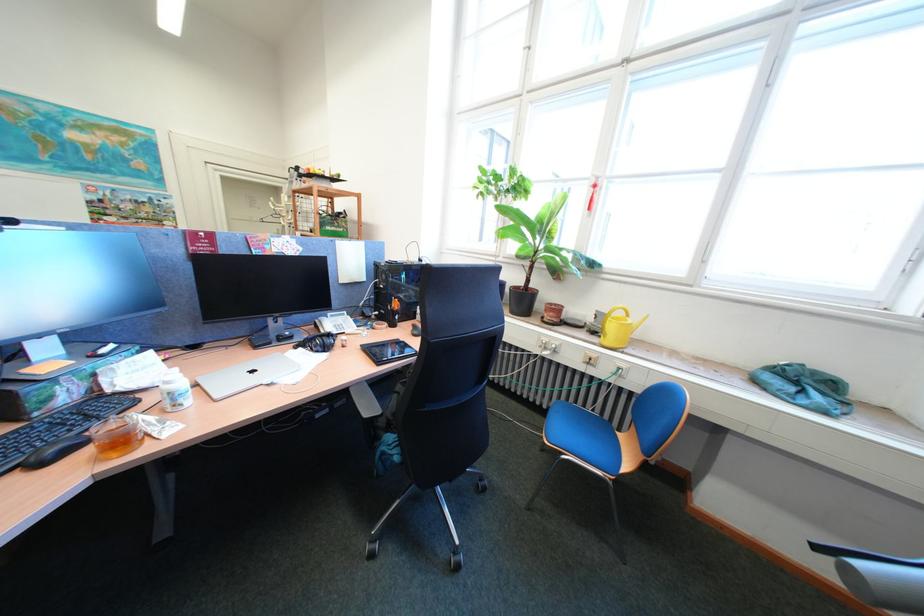
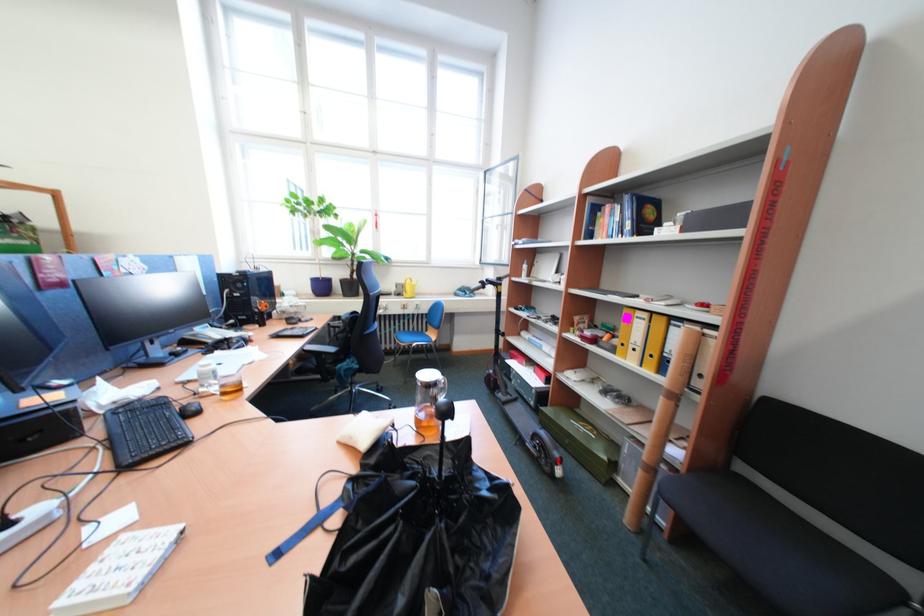
Find the pixel in the second image that matches (594,329) in the first image.

(403, 296)